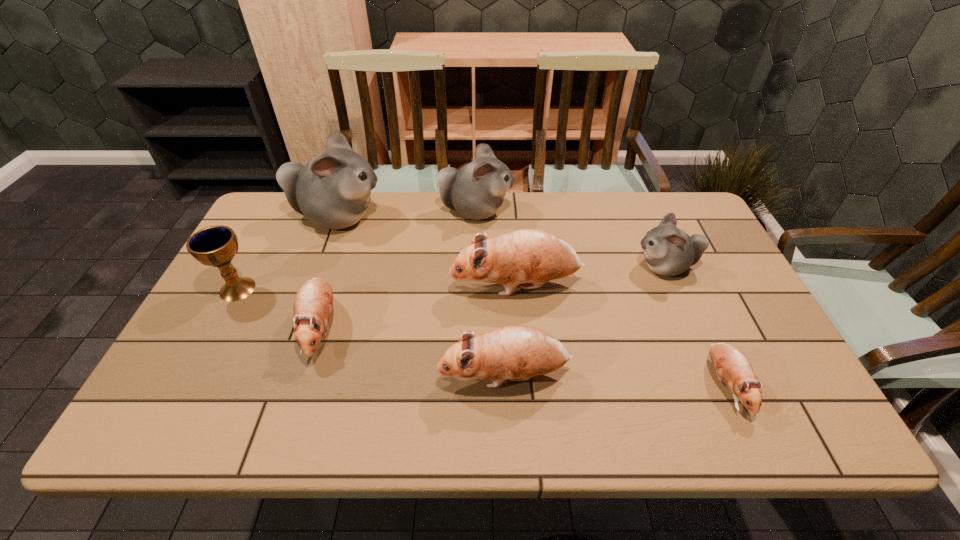
Find the location of a particular element. the leftmost white hamster is located at coordinates (333, 190).

Identify the location of the tallest object. Image resolution: width=960 pixels, height=540 pixels. (333, 190).

This screenshot has width=960, height=540. I want to click on the second smallest white hamster, so click(477, 190).

I want to click on the biggest brown hamster, so [x=527, y=255].

Where is `blue chalice`? The width and height of the screenshot is (960, 540). blue chalice is located at coordinates (216, 246).

You are a GUI agent. You are given a task and a screenshot of the screen. Output one action in this format:
    pyautogui.click(x=<x>, y=<y>)
    Task: Click on the smallest white hamster
    The height and width of the screenshot is (540, 960).
    Given the screenshot: What is the action you would take?
    pyautogui.click(x=668, y=251)

The width and height of the screenshot is (960, 540). What are the coordinates of `the rightmost white hamster` in the screenshot? It's located at (668, 251).

The width and height of the screenshot is (960, 540). In order to click on the third smallest brown hamster in this screenshot , I will do `click(517, 353)`.

The width and height of the screenshot is (960, 540). I want to click on the leftmost brown hamster, so click(x=313, y=302).

The width and height of the screenshot is (960, 540). I want to click on the second shortest object, so click(313, 302).